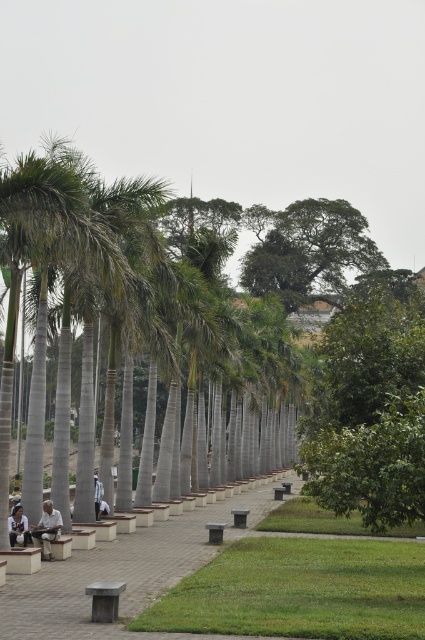
Question: Which object appears closest to the camera in this image?

Choices:
 (A) light blue fabric shirt at center
 (B) light brown wooden bench at lower left

Answer: (B)

Question: Can you confirm if gray concrete bench at center is smaller than light blue fabric shirt at center?

Choices:
 (A) yes
 (B) no

Answer: (B)

Question: Which point appears closest to the camera in this image?

Choices:
 (A) (93, 612)
 (B) (22, 524)
 (C) (14, 598)
 (D) (311, 221)

Answer: (A)

Question: Is light brown leather jacket at lower left smaller than light blue fabric shirt at center?

Choices:
 (A) no
 (B) yes

Answer: (A)

Question: Can you confirm if green leafy tree at upper center is thinner than light brown leather jacket at lower left?

Choices:
 (A) no
 (B) yes

Answer: (A)

Question: Estimate the real-world distances between objects in this image. Which object is closer to the green leafy tree at upper center?

Choices:
 (A) smooth gray bench at lower center
 (B) light blue fabric shirt at center

Answer: (B)